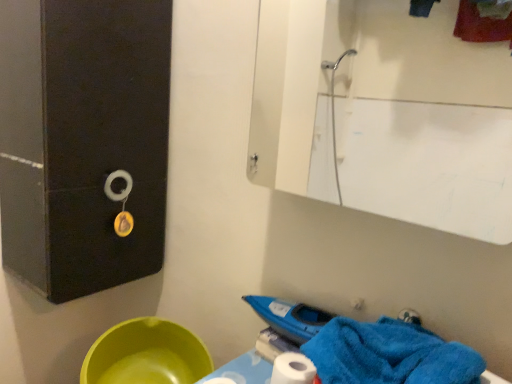
Question: From the image's perspective, is green plastic basin at lower left located beneath white glossy mirror at upper center?

Choices:
 (A) yes
 (B) no

Answer: (A)

Question: Considering the relative sizes of green plastic basin at lower left and white glossy mirror at upper center in the image provided, is green plastic basin at lower left taller than white glossy mirror at upper center?

Choices:
 (A) yes
 (B) no

Answer: (B)

Question: Is green plastic basin at lower left not close to white glossy mirror at upper center?

Choices:
 (A) yes
 (B) no

Answer: (A)

Question: From a real-world perspective, is green plastic basin at lower left over white glossy mirror at upper center?

Choices:
 (A) yes
 (B) no

Answer: (B)

Question: Is green plastic basin at lower left oriented away from white glossy mirror at upper center?

Choices:
 (A) yes
 (B) no

Answer: (B)

Question: Does green plastic basin at lower left come behind white glossy mirror at upper center?

Choices:
 (A) no
 (B) yes

Answer: (B)

Question: Does green plastic basin at lower left have a larger size compared to blue soft towel at lower right?

Choices:
 (A) yes
 (B) no

Answer: (A)

Question: From the image's perspective, is green plastic basin at lower left on top of blue soft towel at lower right?

Choices:
 (A) no
 (B) yes

Answer: (A)

Question: Is green plastic basin at lower left positioned before blue soft towel at lower right?

Choices:
 (A) yes
 (B) no

Answer: (B)

Question: Can you confirm if green plastic basin at lower left is thinner than blue soft towel at lower right?

Choices:
 (A) no
 (B) yes

Answer: (A)

Question: Is green plastic basin at lower left oriented away from blue soft towel at lower right?

Choices:
 (A) yes
 (B) no

Answer: (B)

Question: Can you confirm if green plastic basin at lower left is shorter than blue soft towel at lower right?

Choices:
 (A) no
 (B) yes

Answer: (B)

Question: Is white glossy mirror at upper center far from green plastic basin at lower left?

Choices:
 (A) yes
 (B) no

Answer: (A)